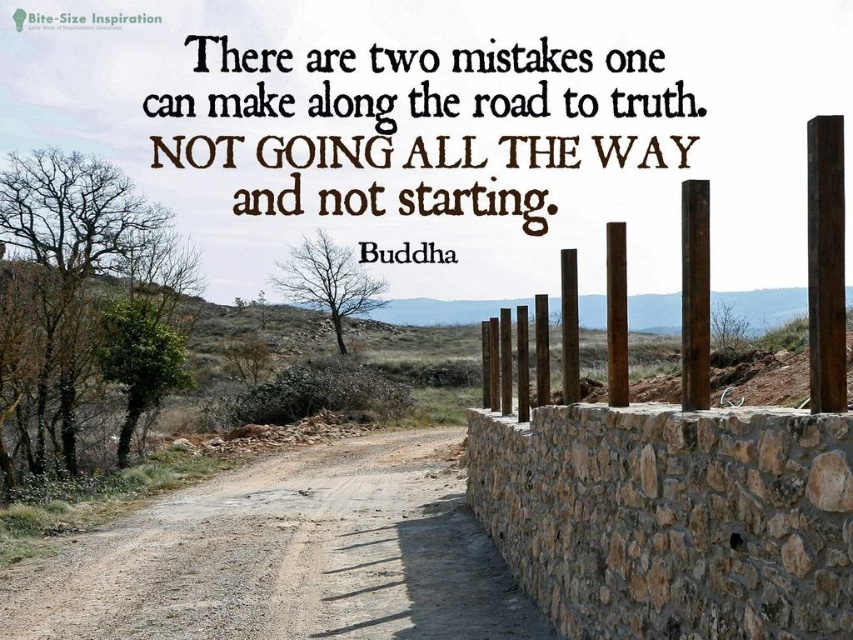
Question: Is brown gravel road at center further to camera compared to rustic wood posts at right?

Choices:
 (A) yes
 (B) no

Answer: (A)

Question: Among these objects, which one is nearest to the camera?

Choices:
 (A) rustic wood posts at right
 (B) brown gravel road at center

Answer: (A)

Question: Which of the following is the closest to the observer?

Choices:
 (A) rustic wood posts at right
 (B) brown gravel road at center

Answer: (A)

Question: Is the position of brown gravel road at center more distant than that of rustic wood posts at right?

Choices:
 (A) yes
 (B) no

Answer: (A)

Question: Does brown gravel road at center come in front of rustic wood posts at right?

Choices:
 (A) no
 (B) yes

Answer: (A)